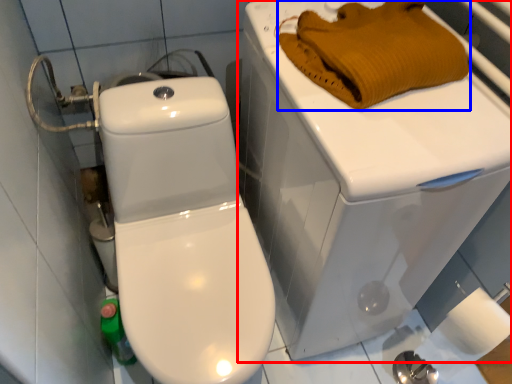
Question: Which object is closer to the camera taking this photo, porcelain (highlighted by a red box) or material (highlighted by a blue box)?

Choices:
 (A) porcelain
 (B) material

Answer: (A)